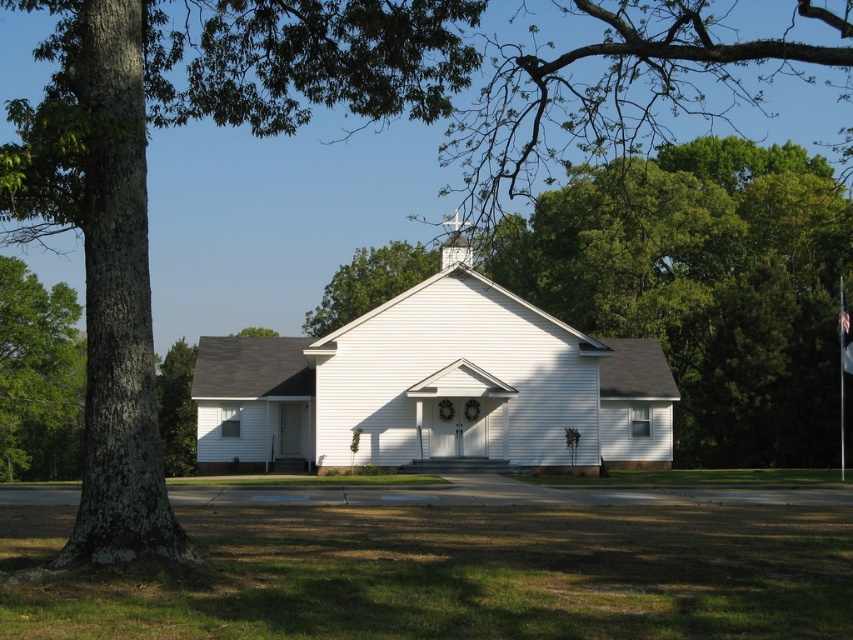
Does green leafy tree at center appear on the right side of green leafy tree at left?

Correct, you'll find green leafy tree at center to the right of green leafy tree at left.

This screenshot has height=640, width=853. What do you see at coordinates (704, 285) in the screenshot?
I see `green leafy tree at center` at bounding box center [704, 285].

This screenshot has height=640, width=853. What do you see at coordinates (704, 285) in the screenshot?
I see `green leafy tree at center` at bounding box center [704, 285].

The height and width of the screenshot is (640, 853). In order to click on green leafy tree at center in this screenshot , I will do `click(704, 285)`.

Which is more to the right, green leafy tree at center or white wood spire at upper center?

From the viewer's perspective, green leafy tree at center appears more on the right side.

Between point (646, 328) and point (471, 248), which one is positioned behind?

The point (646, 328) is more distant.

I want to click on green leafy tree at center, so click(x=704, y=285).

Does green rough bark tree at left lie behind white wood spire at upper center?

No, it is in front of white wood spire at upper center.

Is green rough bark tree at left below white wood spire at upper center?

Actually, green rough bark tree at left is above white wood spire at upper center.

Identify the location of green rough bark tree at left. This screenshot has height=640, width=853. (146, 186).

You are a GUI agent. You are given a task and a screenshot of the screen. Output one action in this format:
    pyautogui.click(x=<x>, y=<y>)
    Task: Click on the green rough bark tree at left
    This screenshot has height=640, width=853.
    Given the screenshot: What is the action you would take?
    pyautogui.click(x=146, y=186)